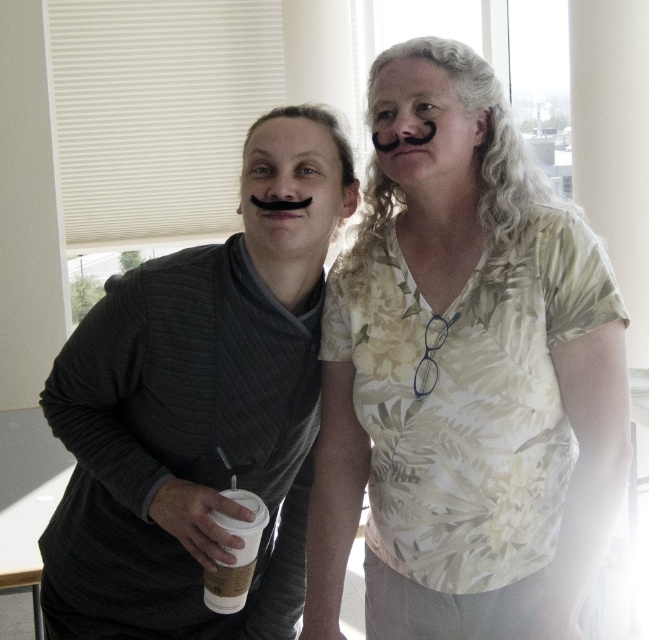
Identify the location of floral print blouse at center. (463, 376).

Is point (572, 374) closer to viewer compared to point (323, 205)?

Yes, it is in front of point (323, 205).

Is point (458, 456) positioned in front of point (153, 538)?

Yes.

This screenshot has height=640, width=649. Identify the location of floral print blouse at center. (463, 376).

Can you confirm if black matte mustache at center is smaller than brown paper cup at lower left?

No.

This screenshot has height=640, width=649. What do you see at coordinates (291, 188) in the screenshot?
I see `black matte mustache at center` at bounding box center [291, 188].

Who is more forward, [284,192] or [210,573]?

Point [210,573]

The image size is (649, 640). I want to click on black matte mustache at center, so tap(291, 188).

Does black matte mustache at center have a smaller size compared to black matte mustache at upper center?

Actually, black matte mustache at center might be larger than black matte mustache at upper center.

Does black matte mustache at center appear under black matte mustache at upper center?

Yes.

This screenshot has width=649, height=640. I want to click on black matte mustache at center, so click(291, 188).

Find the location of a particular element. black matte mustache at center is located at coordinates (291, 188).